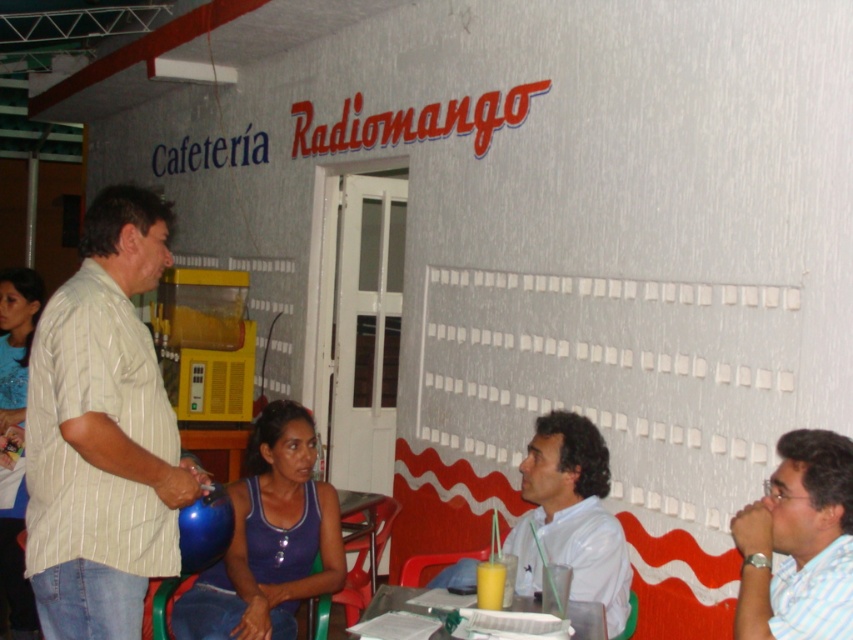
You are a waiter at Cafeteriya Radiomango. You need to place a drink order slip on the table so that it is directly in front of the customer wearing the white glossy shirt at center. Where should you place the slip relative to the translucent plastic table at lower center?

The white glossy shirt at center is to the right of the translucent plastic table at lower center, so place the slip to the right side of the translucent plastic table at lower center to position it directly in front of the customer wearing the white glossy shirt at center.

You are standing in front of the yellow beverage dispenser in Cafetera Radiomango. You see two points marked on the wall in front of you. The first point is at coordinates point (610, 545) and the second point is at point (575, 625). Which point is closer to you?

Point (610, 545) is closer to you because it is further to the viewer than point (575, 625).

You are standing in front of the yellow beverage dispenser in the Cafetera Radiomango. You see two points marked on the wall. The first point is at coordinates point (154, 534) and the second point is at point (541, 481). Which point is closer to you?

Point (154, 534) is closer to the viewer than point (541, 481).